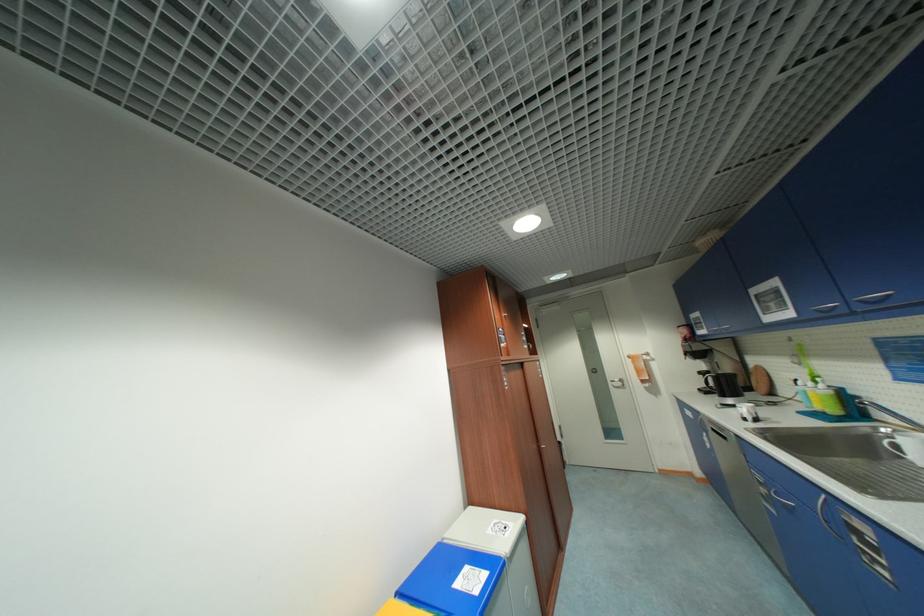
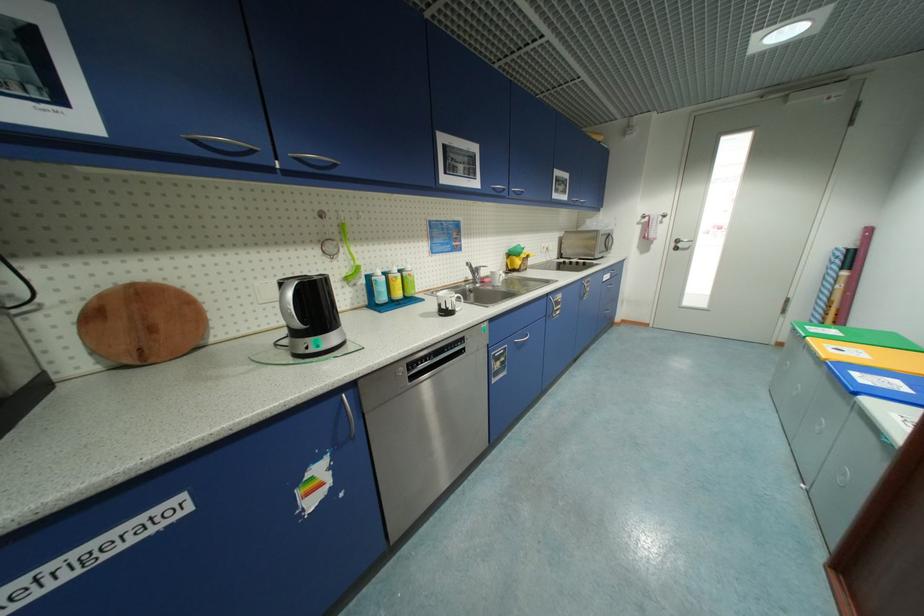
In the second image, find the point that corresponds to point (822, 312) in the first image.

(499, 190)